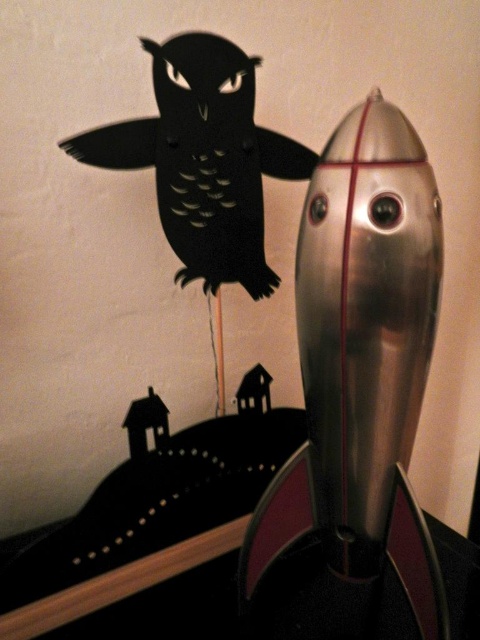
You are an astronaut preparing to launch a small toy owl into space. The shiny metallic rocket at right has a height restriction. Can the black paper owl at upper left fit inside the rocket based on their sizes?

The shiny metallic rocket at right is much taller than the black paper owl at upper left, so the black paper owl at upper left can fit inside the rocket.

You are an astronaut trying to locate your rocket. You see a point at coordinates (356, 401). Which object is located at that point?

The point at coordinates (356, 401) corresponds to the shiny metallic rocket at right.